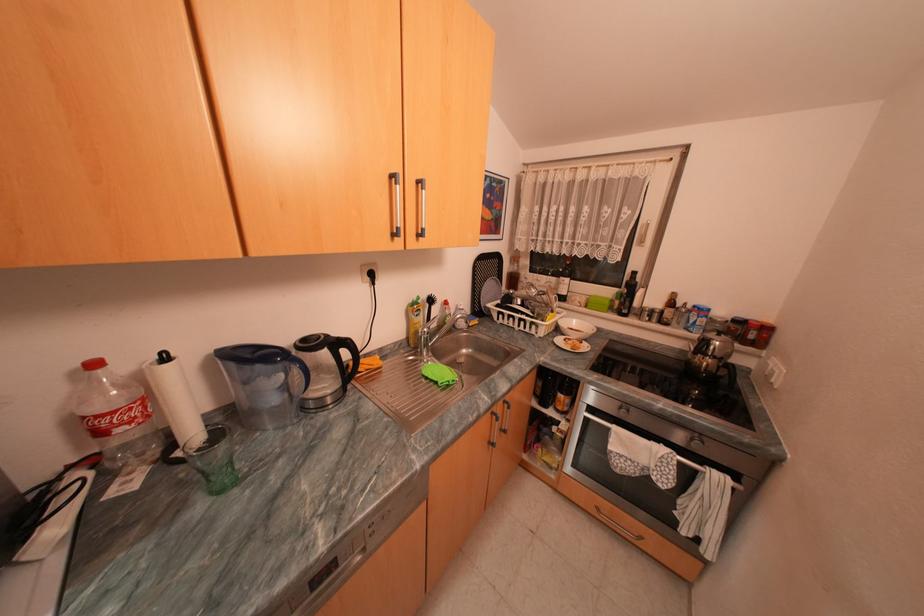
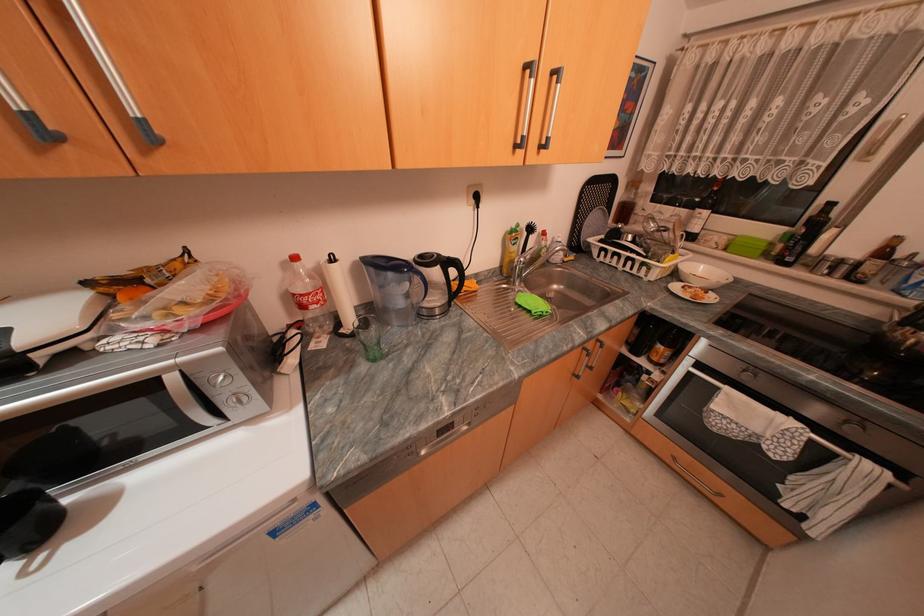
Locate, in the second image, the point that corresponds to [618,428] in the first image.

(727, 389)